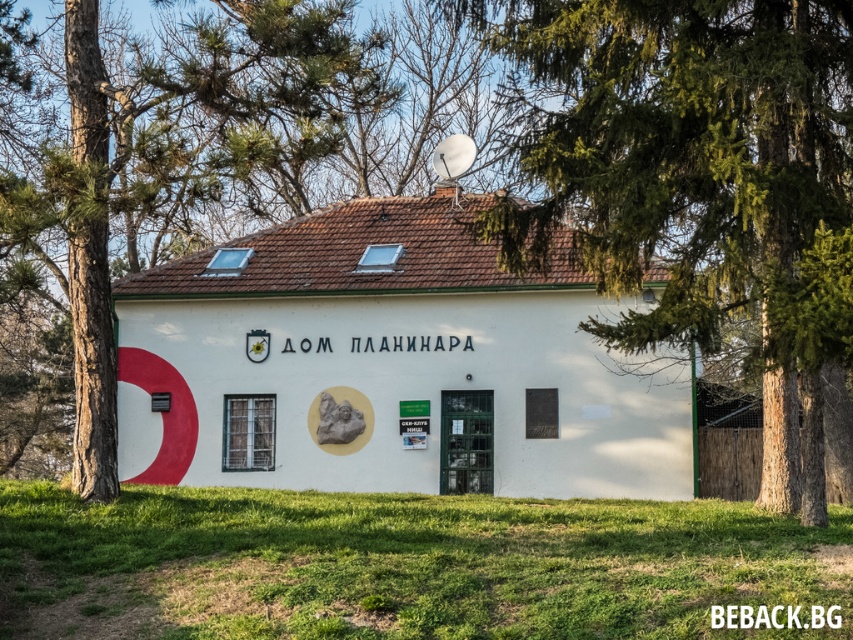
Question: Which point appears closest to the camera in this image?

Choices:
 (A) (805, 1)
 (B) (317, 22)

Answer: (A)

Question: Can you confirm if green grass at lower center is bigger than brown textured tree at left?

Choices:
 (A) yes
 (B) no

Answer: (B)

Question: Based on their relative distances, which object is nearer to the green grass at lower center?

Choices:
 (A) green textured tree at center
 (B) brown textured tree at left

Answer: (A)

Question: Which point is farther to the camera?

Choices:
 (A) (596, 509)
 (B) (328, 44)
 (C) (728, 20)

Answer: (B)

Question: Is green textured tree at center bigger than green grass at lower center?

Choices:
 (A) yes
 (B) no

Answer: (A)

Question: Does green grass at lower center come in front of brown textured tree at left?

Choices:
 (A) no
 (B) yes

Answer: (B)